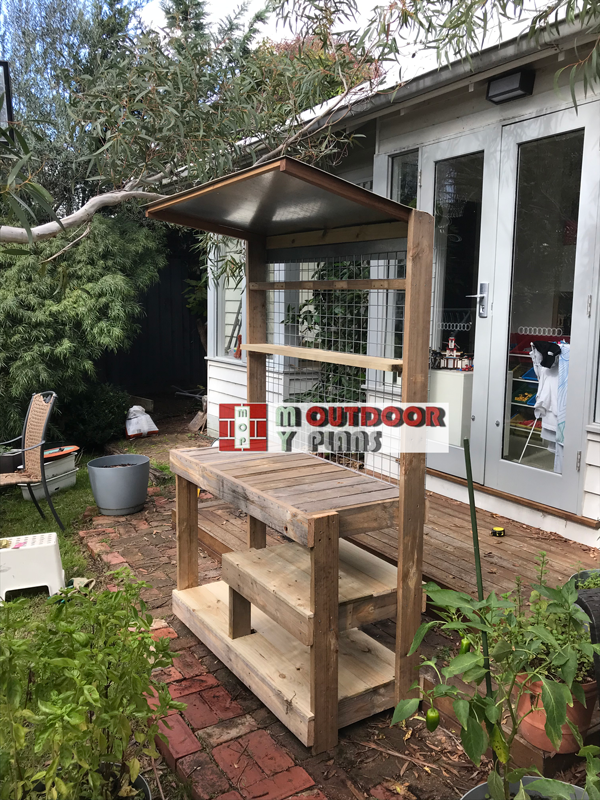
This screenshot has height=800, width=600. In order to click on plant in this screenshot , I will do `click(462, 668)`.